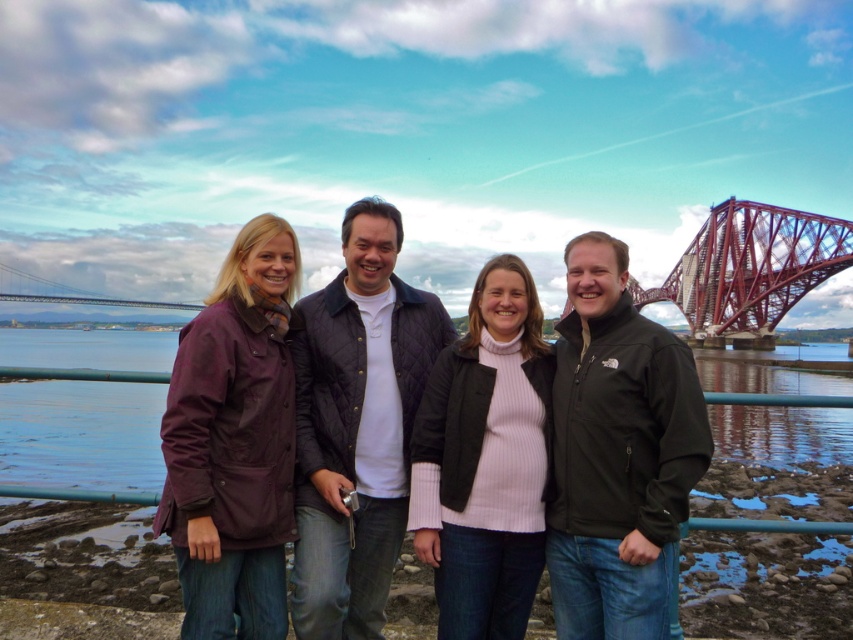
Question: Is matte purple jacket at center further to camera compared to red metal bridge at upper right?

Choices:
 (A) yes
 (B) no

Answer: (B)

Question: Is matte purple jacket at center above red metal bridge at upper right?

Choices:
 (A) no
 (B) yes

Answer: (A)

Question: Which object appears closest to the camera in this image?

Choices:
 (A) matte purple jacket at center
 (B) red metal bridge at upper right

Answer: (A)

Question: Which point is closer to the camera?

Choices:
 (A) matte purple jacket at center
 (B) red metal bridge at upper right

Answer: (A)

Question: Does matte purple jacket at center appear on the left side of red metal bridge at upper right?

Choices:
 (A) yes
 (B) no

Answer: (A)